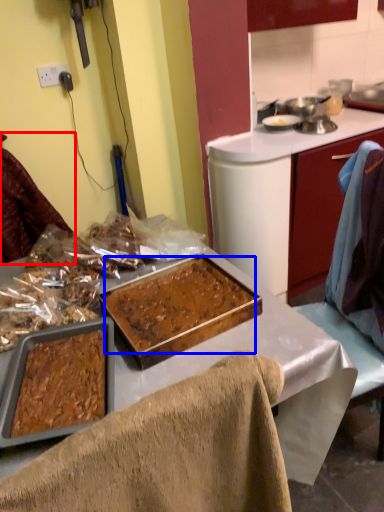
Question: Which object appears farthest to the camera in this image, leftover (highlighted by a red box) or food (highlighted by a blue box)?

Choices:
 (A) leftover
 (B) food

Answer: (A)